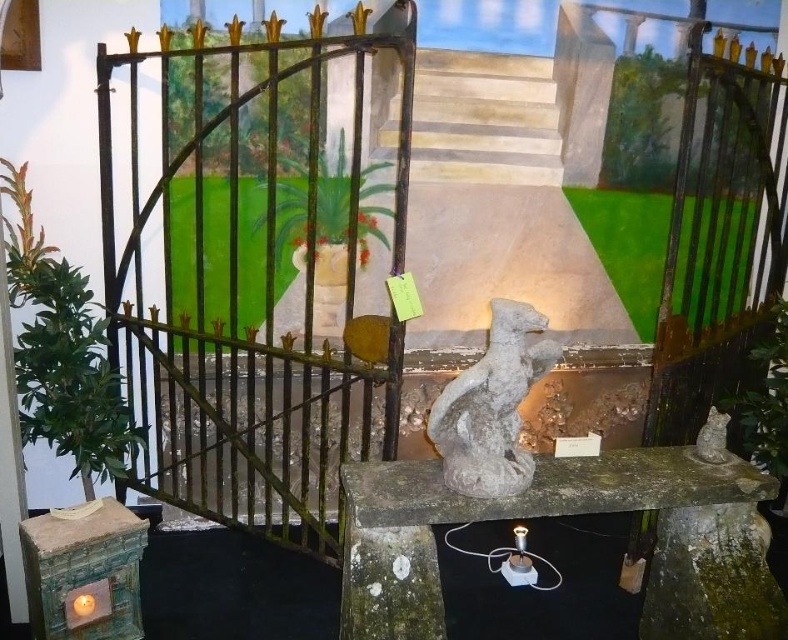
Question: Can you confirm if green leafy plant at left is bigger than green leafy plant at right?

Choices:
 (A) yes
 (B) no

Answer: (A)

Question: Is stone balustrade at center further to the viewer compared to gray stone cat at lower right?

Choices:
 (A) yes
 (B) no

Answer: (B)

Question: Is beige stone stairs at upper center positioned at the back of matte white vase at center?

Choices:
 (A) yes
 (B) no

Answer: (A)

Question: Which object appears closest to the camera in this image?

Choices:
 (A) green leafy plant at right
 (B) green matte plant at center

Answer: (A)

Question: Which is nearer to the green leafy plant at right?

Choices:
 (A) beige stone stairs at upper center
 (B) stone balustrade at center

Answer: (B)

Question: Which of these objects is positioned closest to the gray stone cat at center?

Choices:
 (A) green matte vase at center
 (B) stone balustrade at center

Answer: (B)